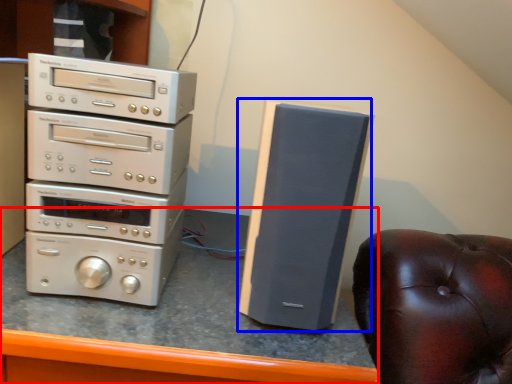
Question: Which object appears farthest to the camera in this image, computer desk (highlighted by a red box) or speaker (highlighted by a blue box)?

Choices:
 (A) computer desk
 (B) speaker

Answer: (B)